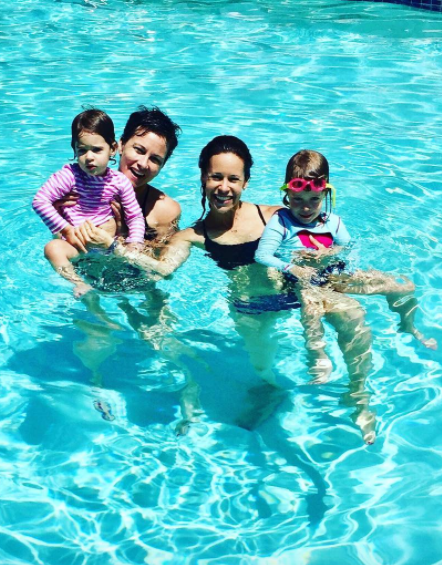
In order to click on dark blue tiles in this screenshot , I will do `click(430, 5)`.